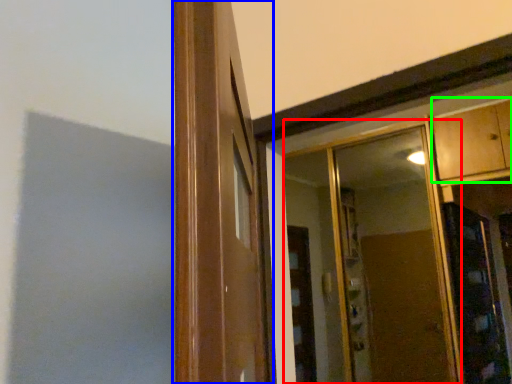
Question: Which object is the closest to the mirror (highlighted by a red box)? Choose among these: window frame (highlighted by a blue box) or cabinetry (highlighted by a green box).

Choices:
 (A) window frame
 (B) cabinetry

Answer: (B)